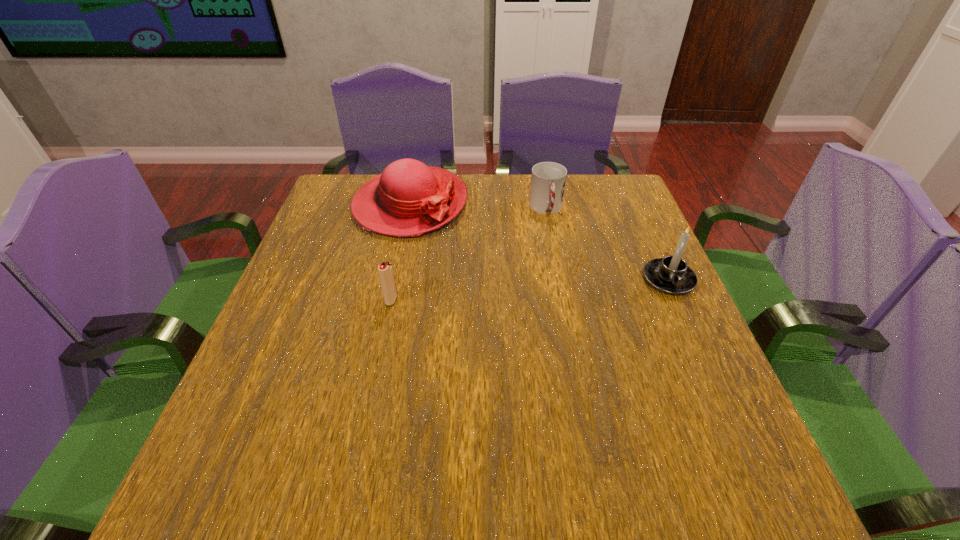
The height and width of the screenshot is (540, 960). What are the coordinates of `free space between the candle holder and the igniter` in the screenshot? It's located at (530, 290).

At what (x,y) coordinates should I click in order to perform the action: click on free spot between the third object from left to right and the candle holder. Please return your answer as a coordinate pair (x, y). Image resolution: width=960 pixels, height=540 pixels. Looking at the image, I should click on (608, 245).

Where is `empty location between the igniter and the second object from right to left`? The image size is (960, 540). empty location between the igniter and the second object from right to left is located at coordinates (468, 254).

Identify the location of free spot between the candle holder and the third object from left to right. (608, 245).

Locate which object ranks third in proximity to the rightmost object. Please provide its 2D coordinates. Your answer should be formatted as a tuple, i.e. [(x, y)], where the tuple contains the x and y coordinates of a point satisfying the conditions above.

[(385, 269)]

Identify the location of the third closest object to the igniter. This screenshot has height=540, width=960. (671, 275).

I want to click on blank area in the image that satisfies the following two spatial constraints: 1. on the back side of the igniter; 2. on the left side of the third object from left to right, so click(410, 209).